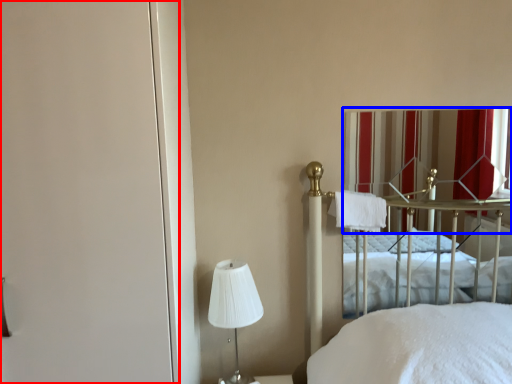
Question: Which of the following is the farthest to the observer, screen door (highlighted by a red box) or curtain (highlighted by a blue box)?

Choices:
 (A) screen door
 (B) curtain

Answer: (B)